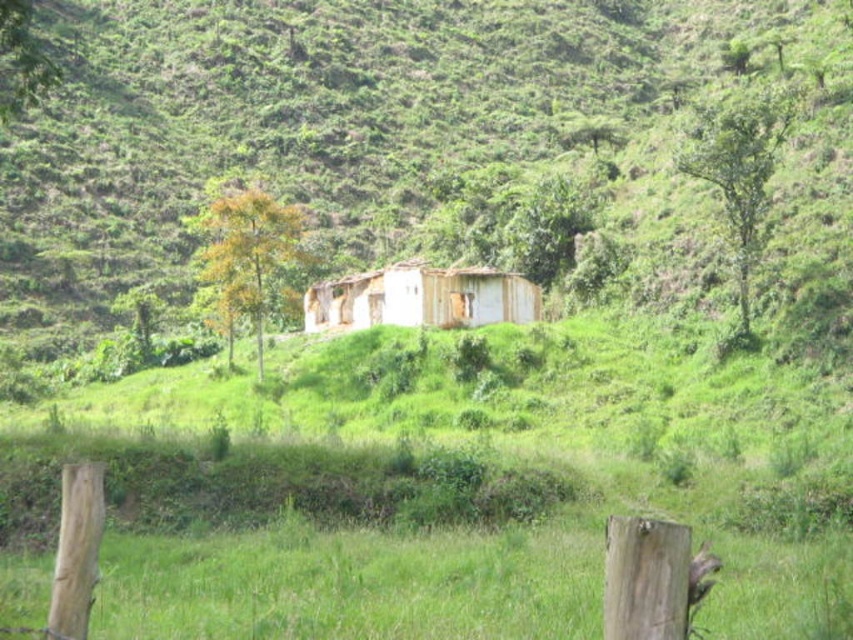
Question: Does rusty metal shack at center have a lesser width compared to white wooden hut at center?

Choices:
 (A) no
 (B) yes

Answer: (A)

Question: Which object is farther from the camera taking this photo?

Choices:
 (A) rusty metal shack at center
 (B) white wooden hut at center

Answer: (B)

Question: Can you confirm if rusty metal shack at center is positioned below white wooden hut at center?

Choices:
 (A) yes
 (B) no

Answer: (B)

Question: Which object is farther from the camera taking this photo?

Choices:
 (A) white wooden hut at center
 (B) rusty metal shack at center

Answer: (A)

Question: Does rusty metal shack at center appear over white wooden hut at center?

Choices:
 (A) yes
 (B) no

Answer: (A)